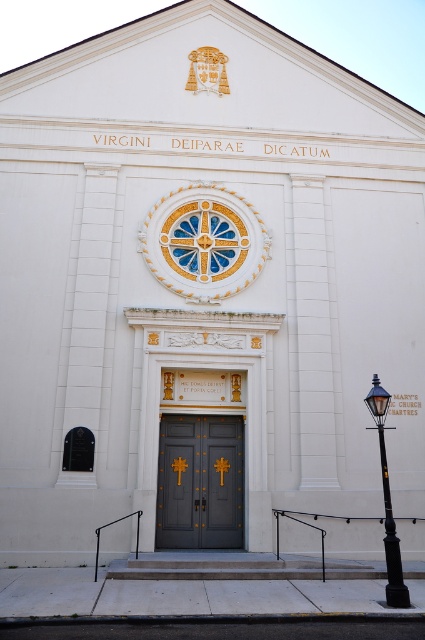
Question: Which object appears closest to the camera in this image?

Choices:
 (A) dark gray wood doors at center
 (B) black metal streetlight at lower right

Answer: (B)

Question: Is dark gray wood doors at center below black metal streetlight at lower right?

Choices:
 (A) no
 (B) yes

Answer: (B)

Question: Which of the following is the farthest from the observer?

Choices:
 (A) black metal streetlight at lower right
 (B) dark gray wood doors at center

Answer: (B)

Question: Is dark gray wood doors at center wider than black metal streetlight at lower right?

Choices:
 (A) yes
 (B) no

Answer: (A)

Question: Which object is farther from the camera taking this photo?

Choices:
 (A) dark gray wood doors at center
 (B) black metal streetlight at lower right

Answer: (A)

Question: Is dark gray wood doors at center wider than black metal streetlight at lower right?

Choices:
 (A) yes
 (B) no

Answer: (A)